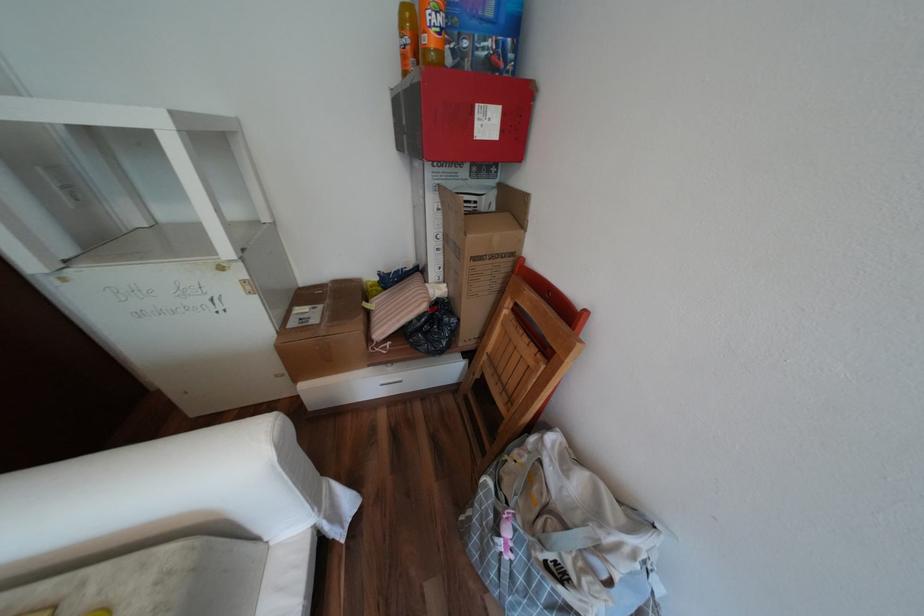
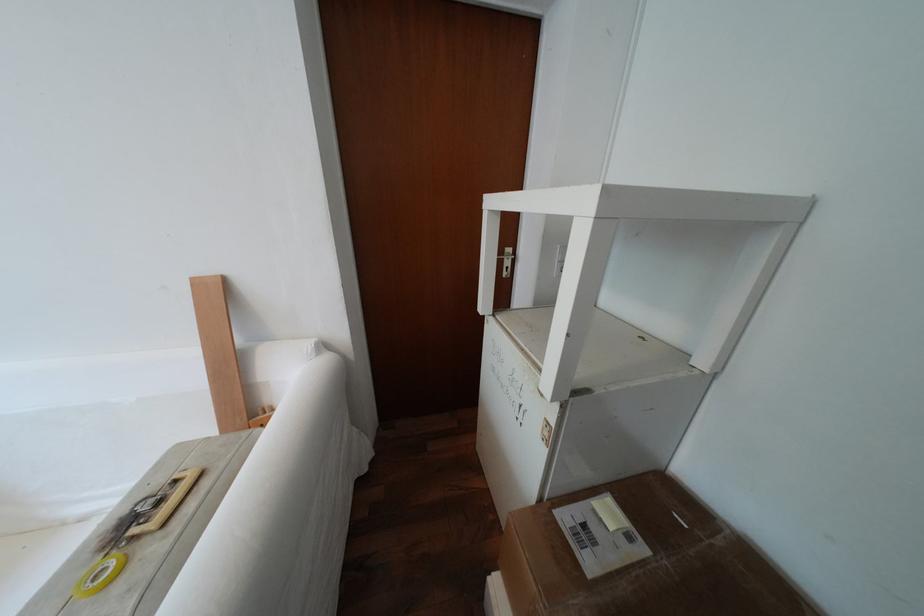
Based on the continuous images, in which direction is the camera rotating?

The camera rotated toward left-down.